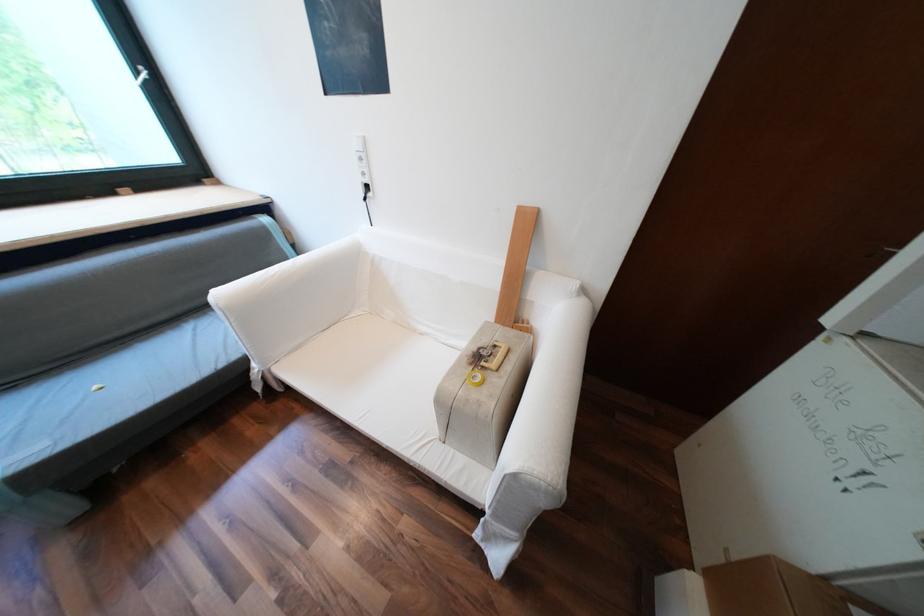
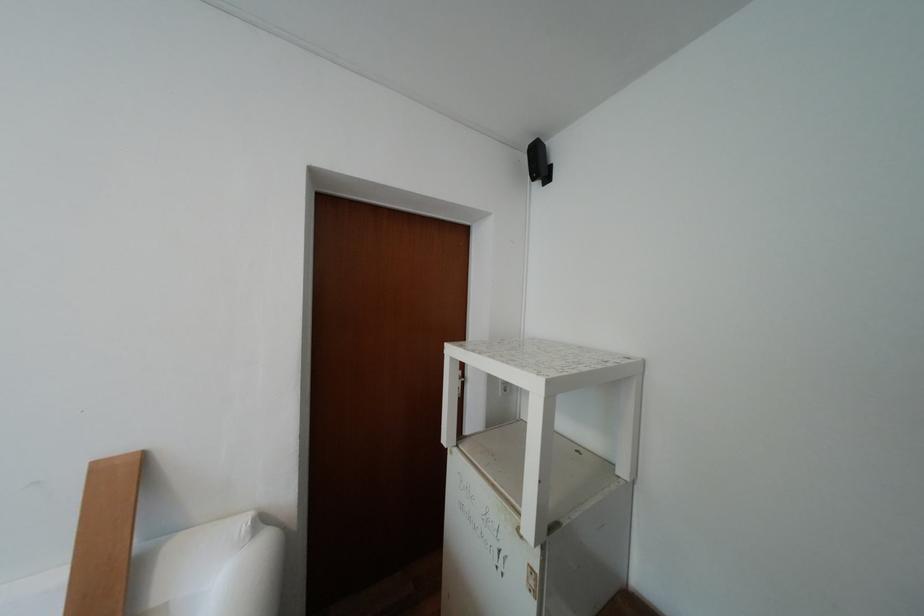
Where in the second image is the point corresponding to pixel 588 294 from the first image?

(263, 535)